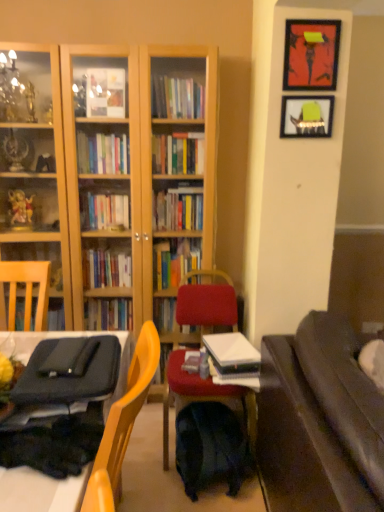
This screenshot has height=512, width=384. I want to click on metallic framed artwork at upper right, arranged as the first picture frame when viewed from the top, so click(x=311, y=54).

How much space does metallic framed artwork at upper right, arranged as the first picture frame when viewed from the top, occupy horizontally?

The width of metallic framed artwork at upper right, arranged as the first picture frame when viewed from the top, is 2.87 inches.

Identify the location of dark brown leather couch at right. The height and width of the screenshot is (512, 384). (319, 422).

Locate an element on the screen. The image size is (384, 512). velvet red chair at center is located at coordinates (206, 303).

Find the location of a particular element. matte green picture frame at upper right, arranged as the second picture frame when viewed from the top is located at coordinates (306, 116).

At what (x,y) coordinates should I click in order to perform the action: click on metallic framed artwork at upper right, marked as the second picture frame in a bottom-to-top arrangement. Please return your answer as a coordinate pair (x, y). The width and height of the screenshot is (384, 512). Looking at the image, I should click on (311, 54).

Looking at this image, how different are the orientations of white paper stack at center and matte black laptop at left in degrees?

The angular difference between white paper stack at center and matte black laptop at left is 8.85 degrees.

Looking at this image, is white paper stack at center facing away from matte black laptop at left?

That's not correct — white paper stack at center is not looking away from matte black laptop at left.

Between white paper stack at center and matte black laptop at left, which one appears on the right side from the viewer's perspective?

white paper stack at center.

Which point is more distant from viewer, (243, 350) or (45, 332)?

The point (243, 350) is farther from the camera.

Is matte green picture frame at upper right, which is the first picture frame from bottom to top, touching dark blue fabric backpack at center?

No, matte green picture frame at upper right, which is the first picture frame from bottom to top, is not making contact with dark blue fabric backpack at center.

How many degrees apart are the facing directions of matte green picture frame at upper right, which is the first picture frame from bottom to top, and dark blue fabric backpack at center?

There is a 85.1-degree angle between the facing directions of matte green picture frame at upper right, which is the first picture frame from bottom to top, and dark blue fabric backpack at center.

Is matte green picture frame at upper right, which is the first picture frame from bottom to top, in front of or behind dark blue fabric backpack at center in the image?

In the image, matte green picture frame at upper right, which is the first picture frame from bottom to top, appears behind dark blue fabric backpack at center.

Between matte green picture frame at upper right, arranged as the second picture frame when viewed from the top, and dark blue fabric backpack at center, which one appears on the right side from the viewer's perspective?

matte green picture frame at upper right, arranged as the second picture frame when viewed from the top, is more to the right.

Is dark brown leather couch at right oriented away from dark blue fabric backpack at center?

Correct, dark brown leather couch at right is looking away from dark blue fabric backpack at center.

Can you confirm if dark brown leather couch at right is taller than dark blue fabric backpack at center?

Yes.

Is dark brown leather couch at right far away from dark blue fabric backpack at center?

No, dark brown leather couch at right is in close proximity to dark blue fabric backpack at center.

The width and height of the screenshot is (384, 512). Find the location of `studio couch that is in front of the dark blue fabric backpack at center`. studio couch that is in front of the dark blue fabric backpack at center is located at coordinates (319, 422).

In terms of height, does metallic framed artwork at upper right, arranged as the first picture frame when viewed from the top, look taller or shorter compared to white paper stack at center?

Considering their sizes, metallic framed artwork at upper right, arranged as the first picture frame when viewed from the top, has more height than white paper stack at center.

From the image's perspective, does metallic framed artwork at upper right, arranged as the first picture frame when viewed from the top, appear higher than white paper stack at center?

Indeed, from the image's perspective, metallic framed artwork at upper right, arranged as the first picture frame when viewed from the top, is shown above white paper stack at center.

Does metallic framed artwork at upper right, arranged as the first picture frame when viewed from the top, appear on the right side of white paper stack at center?

Indeed, metallic framed artwork at upper right, arranged as the first picture frame when viewed from the top, is positioned on the right side of white paper stack at center.

Which is behind, dark blue fabric backpack at center or velvet red chair at center?

velvet red chair at center is further away from the camera.

Is dark blue fabric backpack at center not near velvet red chair at center?

No, dark blue fabric backpack at center is in close proximity to velvet red chair at center.

The image size is (384, 512). Identify the location of backpack located underneath the velvet red chair at center (from a real-world perspective). (210, 448).

From the image's perspective, which object appears higher, dark blue fabric backpack at center or velvet red chair at center?

velvet red chair at center is shown above in the image.

Who is more distant, dark blue fabric backpack at center or matte green picture frame at upper right, which is the first picture frame from bottom to top?

matte green picture frame at upper right, which is the first picture frame from bottom to top, is behind.

Is dark blue fabric backpack at center situated inside matte green picture frame at upper right, arranged as the second picture frame when viewed from the top, or outside?

dark blue fabric backpack at center is spatially situated outside matte green picture frame at upper right, arranged as the second picture frame when viewed from the top.

From the image's perspective, which object appears higher, dark blue fabric backpack at center or matte green picture frame at upper right, which is the first picture frame from bottom to top?

matte green picture frame at upper right, which is the first picture frame from bottom to top, is shown above in the image.

From the image's perspective, is metallic framed artwork at upper right, arranged as the first picture frame when viewed from the top, located beneath dark brown leather couch at right?

No, from the image's perspective, metallic framed artwork at upper right, arranged as the first picture frame when viewed from the top, is not beneath dark brown leather couch at right.

Is metallic framed artwork at upper right, marked as the second picture frame in a bottom-to-top arrangement, thinner than dark brown leather couch at right?

Correct, the width of metallic framed artwork at upper right, marked as the second picture frame in a bottom-to-top arrangement, is less than that of dark brown leather couch at right.

Between metallic framed artwork at upper right, marked as the second picture frame in a bottom-to-top arrangement, and dark brown leather couch at right, which one appears on the right side from the viewer's perspective?

From the viewer's perspective, dark brown leather couch at right appears more on the right side.

Where is `book behind the matte black laptop at left`? book behind the matte black laptop at left is located at coordinates (231, 349).

Find the location of a particular element. backpack on the left of matte green picture frame at upper right, which is the first picture frame from bottom to top is located at coordinates (210, 448).

Estimate the real-world distances between objects in this image. Which object is further from dark brown leather couch at right, matte black laptop at left or metallic framed artwork at upper right, arranged as the first picture frame when viewed from the top?

The object further to dark brown leather couch at right is metallic framed artwork at upper right, arranged as the first picture frame when viewed from the top.

From the image, which object appears to be nearer to metallic framed artwork at upper right, marked as the second picture frame in a bottom-to-top arrangement, dark brown leather couch at right or velvet red chair at center?

The object closer to metallic framed artwork at upper right, marked as the second picture frame in a bottom-to-top arrangement, is velvet red chair at center.

When comparing their distances from dark blue fabric backpack at center, does white paper stack at center or matte green picture frame at upper right, which is the first picture frame from bottom to top, seem closer?

white paper stack at center is closer to dark blue fabric backpack at center.

When comparing their distances from metallic framed artwork at upper right, arranged as the first picture frame when viewed from the top, does dark brown leather couch at right or matte green picture frame at upper right, which is the first picture frame from bottom to top, seem closer?

matte green picture frame at upper right, which is the first picture frame from bottom to top.

From the image, which object appears to be nearer to metallic framed artwork at upper right, arranged as the first picture frame when viewed from the top, matte black laptop at left or velvet red chair at center?

velvet red chair at center lies closer to metallic framed artwork at upper right, arranged as the first picture frame when viewed from the top, than the other object.

Considering their positions, is white paper stack at center positioned closer to matte black laptop at left than metallic framed artwork at upper right, arranged as the first picture frame when viewed from the top?

Based on the image, white paper stack at center appears to be nearer to matte black laptop at left.

From the image, which object appears to be farther from matte green picture frame at upper right, which is the first picture frame from bottom to top, velvet red chair at center or white paper stack at center?

white paper stack at center.

Based on their spatial positions, is matte black laptop at left or dark brown leather couch at right further from matte green picture frame at upper right, which is the first picture frame from bottom to top?

matte black laptop at left is further to matte green picture frame at upper right, which is the first picture frame from bottom to top.

At what (x,y) coordinates should I click in order to perform the action: click on studio couch between metallic framed artwork at upper right, arranged as the first picture frame when viewed from the top, and dark blue fabric backpack at center in the up-down direction. Please return your answer as a coordinate pair (x, y). The height and width of the screenshot is (512, 384). Looking at the image, I should click on (319, 422).

At what (x,y) coordinates should I click in order to perform the action: click on book between matte green picture frame at upper right, arranged as the second picture frame when viewed from the top, and matte black laptop at left from top to bottom. Please return your answer as a coordinate pair (x, y). Looking at the image, I should click on (231, 349).

The height and width of the screenshot is (512, 384). What are the coordinates of `chair located between dark brown leather couch at right and white paper stack at center in the depth direction` in the screenshot? It's located at (206, 303).

This screenshot has height=512, width=384. What are the coordinates of `backpack between dark brown leather couch at right and white paper stack at center along the z-axis` in the screenshot? It's located at point(210,448).